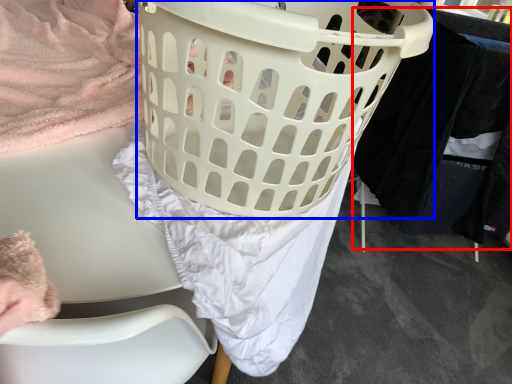
Question: Which of the following is the closest to the observer, clothing (highlighted by a red box) or basket (highlighted by a blue box)?

Choices:
 (A) clothing
 (B) basket

Answer: (B)